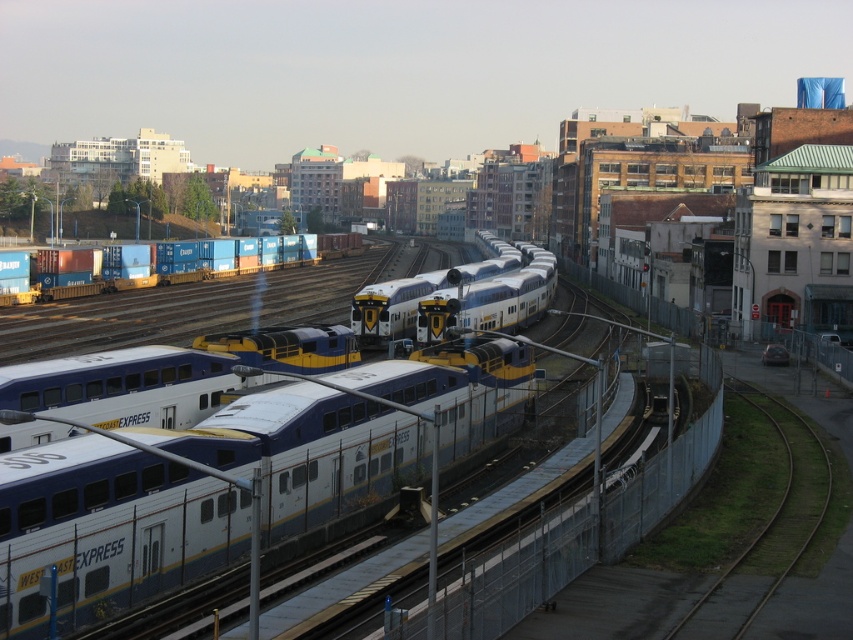
You are a photographer standing at the edge of the railway fence. You want to take a photo of the white glossy passenger train at center and the green grass train track at lower right. Which object will appear larger in your photo?

The white glossy passenger train at center will appear larger in the photo because it is closer to the viewer than the green grass train track at lower right.

You are a photographer standing at the edge of the railway fence. You want to take a photo of both point [90,291] and point [808,429] in the scene. Which point is closer to your camera position?

Point [90,291] is further to the camera than point [808,429]. Therefore, point [808,429] is closer to the camera position.